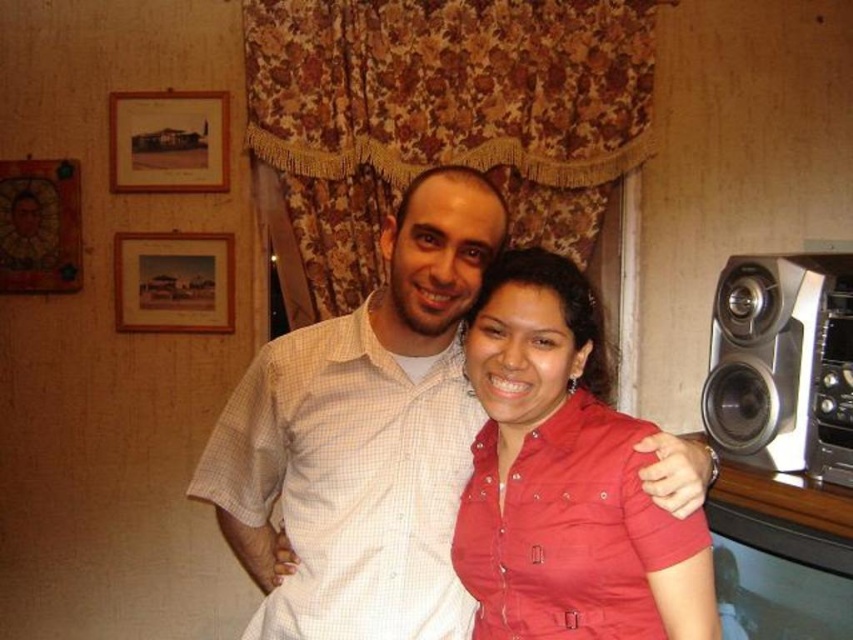
Question: Can you confirm if matte red shirt at center is positioned to the left of silver metallic speaker at right?

Choices:
 (A) yes
 (B) no

Answer: (A)

Question: Does matte red shirt at center have a larger size compared to silver metallic speaker at right?

Choices:
 (A) yes
 (B) no

Answer: (A)

Question: In this image, where is matte red shirt at center located relative to silver metallic speaker at right?

Choices:
 (A) above
 (B) below

Answer: (B)

Question: Estimate the real-world distances between objects in this image. Which object is closer to the white checkered shirt at center?

Choices:
 (A) silver metallic speaker at right
 (B) matte red shirt at center

Answer: (B)

Question: Which is farther from the matte red shirt at center?

Choices:
 (A) silver metallic speaker at right
 (B) white checkered shirt at center

Answer: (A)

Question: Which object is positioned closest to the matte red shirt at center?

Choices:
 (A) silver metallic speaker at right
 (B) white checkered shirt at center

Answer: (B)